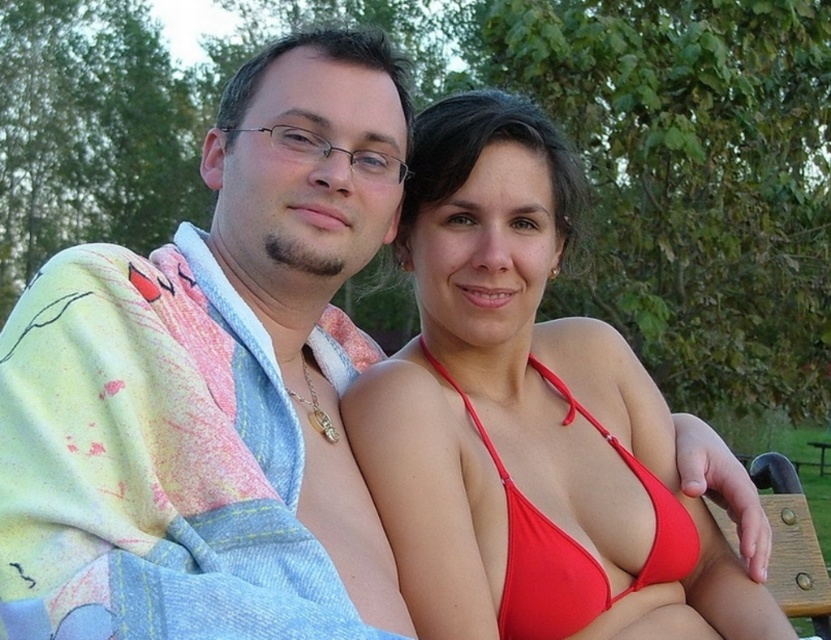
Question: Is multicolored tie-dye robe at left to the right of red matte bikini top at center from the viewer's perspective?

Choices:
 (A) yes
 (B) no

Answer: (B)

Question: Which point is closer to the camera?

Choices:
 (A) multicolored tie-dye robe at left
 (B) red matte bikini top at center

Answer: (A)

Question: Which object is farther from the camera taking this photo?

Choices:
 (A) red matte bikini top at center
 (B) multicolored tie-dye robe at left

Answer: (A)

Question: Does multicolored tie-dye robe at left appear over red matte bikini top at center?

Choices:
 (A) no
 (B) yes

Answer: (B)

Question: Can you confirm if multicolored tie-dye robe at left is positioned to the left of red matte bikini top at center?

Choices:
 (A) yes
 (B) no

Answer: (A)